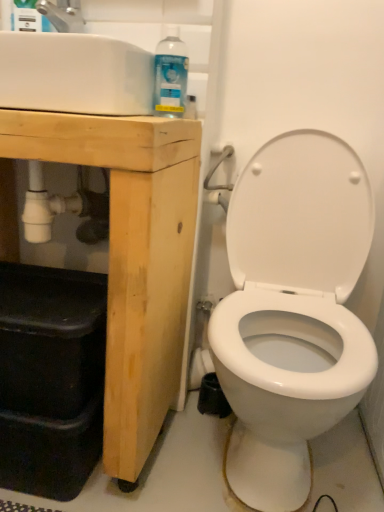
What do you see at coordinates (28, 17) in the screenshot?
I see `clear plastic spray bottle at upper left, which is counted as the second cleaning product, starting from the bottom` at bounding box center [28, 17].

The height and width of the screenshot is (512, 384). I want to click on clear plastic spray bottle at upper left, which ranks as the first cleaning product in top-to-bottom order, so click(x=28, y=17).

Describe the element at coordinates (74, 74) in the screenshot. I see `white glossy sink at upper left` at that location.

Image resolution: width=384 pixels, height=512 pixels. What do you see at coordinates (171, 74) in the screenshot?
I see `clear plastic spray bottle at upper left, the second cleaning product positioned from the top` at bounding box center [171, 74].

At what (x,y) coordinates should I click in order to perform the action: click on natural wood cabinet at left. Please return your answer as a coordinate pair (x, y). The width and height of the screenshot is (384, 512). Looking at the image, I should click on (132, 256).

Where is `brushed metal faucet at upper left`? This screenshot has height=512, width=384. brushed metal faucet at upper left is located at coordinates point(63,15).

The width and height of the screenshot is (384, 512). Find the location of `clear plastic spray bottle at upper left, which appears as the 2th cleaning product when viewed from the right`. clear plastic spray bottle at upper left, which appears as the 2th cleaning product when viewed from the right is located at coordinates (28, 17).

From the image's perspective, which one is positioned lower, natural wood cabinet at left or brushed metal faucet at upper left?

From the image's view, natural wood cabinet at left is below.

Is natural wood cabinet at left wider or thinner than brushed metal faucet at upper left?

natural wood cabinet at left is wider than brushed metal faucet at upper left.

From a real-world perspective, is natural wood cabinet at left physically below brushed metal faucet at upper left?

Correct, in the physical world, natural wood cabinet at left is lower than brushed metal faucet at upper left.

Which point is more forward, (130, 170) or (63, 28)?

Point (130, 170)

Can brushed metal faucet at upper left be found inside clear plastic spray bottle at upper left, the second cleaning product positioned from the top?

That's incorrect, brushed metal faucet at upper left is not inside clear plastic spray bottle at upper left, the second cleaning product positioned from the top.

Is clear plastic spray bottle at upper left, the second cleaning product positioned from the top, placed right next to brushed metal faucet at upper left?

There is a gap between clear plastic spray bottle at upper left, the second cleaning product positioned from the top, and brushed metal faucet at upper left.

From the image's perspective, which one is positioned lower, clear plastic spray bottle at upper left, the second cleaning product positioned from the top, or brushed metal faucet at upper left?

clear plastic spray bottle at upper left, the second cleaning product positioned from the top, from the image's perspective.

Which is in front, point (167, 98) or point (74, 28)?

Positioned in front is point (167, 98).

Is white glossy sink at upper left positioned behind clear plastic spray bottle at upper left, marked as the 1th cleaning product in a right-to-left arrangement?

No, white glossy sink at upper left is closer to the viewer.

Is white glossy sink at upper left not near clear plastic spray bottle at upper left, positioned as the 2th cleaning product in left-to-right order?

No, white glossy sink at upper left is not far away from clear plastic spray bottle at upper left, positioned as the 2th cleaning product in left-to-right order.

Considering the relative sizes of white glossy sink at upper left and clear plastic spray bottle at upper left, which appears as the first cleaning product when ordered from the bottom, in the image provided, is white glossy sink at upper left wider than clear plastic spray bottle at upper left, which appears as the first cleaning product when ordered from the bottom,?

Correct, the width of white glossy sink at upper left exceeds that of clear plastic spray bottle at upper left, which appears as the first cleaning product when ordered from the bottom.

How many degrees apart are the facing directions of clear plastic spray bottle at upper left, which is counted as the second cleaning product, starting from the bottom, and brushed metal faucet at upper left?

The angular difference between clear plastic spray bottle at upper left, which is counted as the second cleaning product, starting from the bottom, and brushed metal faucet at upper left is 0.000125 degrees.

Which of these two, clear plastic spray bottle at upper left, the first cleaning product positioned from the left, or brushed metal faucet at upper left, stands shorter?

Standing shorter between the two is brushed metal faucet at upper left.

Is brushed metal faucet at upper left a part of clear plastic spray bottle at upper left, which appears as the 2th cleaning product when viewed from the right?

That's incorrect, brushed metal faucet at upper left is not inside clear plastic spray bottle at upper left, which appears as the 2th cleaning product when viewed from the right.

Does clear plastic spray bottle at upper left, which is counted as the second cleaning product, starting from the bottom, turn towards brushed metal faucet at upper left?

No.

Between clear plastic spray bottle at upper left, which appears as the first cleaning product when ordered from the bottom, and white glossy sink at upper left, which one has larger size?

With larger size is white glossy sink at upper left.

Looking at this image, is clear plastic spray bottle at upper left, marked as the 1th cleaning product in a right-to-left arrangement, at the right side of white glossy sink at upper left?

Yes, clear plastic spray bottle at upper left, marked as the 1th cleaning product in a right-to-left arrangement, is to the right of white glossy sink at upper left.

Can you confirm if clear plastic spray bottle at upper left, marked as the 1th cleaning product in a right-to-left arrangement, is thinner than white glossy sink at upper left?

Yes, clear plastic spray bottle at upper left, marked as the 1th cleaning product in a right-to-left arrangement, is thinner than white glossy sink at upper left.

Is clear plastic spray bottle at upper left, marked as the 1th cleaning product in a right-to-left arrangement, looking in the opposite direction of white glossy sink at upper left?

No, clear plastic spray bottle at upper left, marked as the 1th cleaning product in a right-to-left arrangement, is not facing away from white glossy sink at upper left.

Can you tell me how much brushed metal faucet at upper left and clear plastic spray bottle at upper left, which ranks as the first cleaning product in top-to-bottom order, differ in facing direction?

They differ by 0.000125 degrees in their facing directions.

Can you confirm if brushed metal faucet at upper left is positioned to the left of clear plastic spray bottle at upper left, which appears as the 2th cleaning product when viewed from the right?

In fact, brushed metal faucet at upper left is to the right of clear plastic spray bottle at upper left, which appears as the 2th cleaning product when viewed from the right.

From the image's perspective, is brushed metal faucet at upper left below clear plastic spray bottle at upper left, the first cleaning product positioned from the left?

Indeed, from the image's perspective, brushed metal faucet at upper left is shown beneath clear plastic spray bottle at upper left, the first cleaning product positioned from the left.

Where is `cleaning product above the brushed metal faucet at upper left (from the image's perspective)`? cleaning product above the brushed metal faucet at upper left (from the image's perspective) is located at coordinates (28, 17).

Can we say clear plastic spray bottle at upper left, which appears as the 2th cleaning product when viewed from the right, lies outside white glossy sink at upper left?

That's correct, clear plastic spray bottle at upper left, which appears as the 2th cleaning product when viewed from the right, is outside of white glossy sink at upper left.

From a real-world perspective, is clear plastic spray bottle at upper left, which ranks as the first cleaning product in top-to-bottom order, on top of white glossy sink at upper left?

Yes, from a real-world perspective, clear plastic spray bottle at upper left, which ranks as the first cleaning product in top-to-bottom order, is on top of white glossy sink at upper left.

Which is more to the right, clear plastic spray bottle at upper left, which appears as the 2th cleaning product when viewed from the right, or white glossy sink at upper left?

white glossy sink at upper left.

Does clear plastic spray bottle at upper left, the first cleaning product positioned from the left, have a smaller size compared to white glossy sink at upper left?

Yes.

Locate an element on the screen. The image size is (384, 512). tap that appears above the natural wood cabinet at left (from the image's perspective) is located at coordinates (63, 15).

At what (x,y) coordinates should I click in order to perform the action: click on cleaning product in front of the brushed metal faucet at upper left. Please return your answer as a coordinate pair (x, y). Looking at the image, I should click on (171, 74).

From the image, which object appears to be farther from clear plastic spray bottle at upper left, which is counted as the second cleaning product, starting from the bottom, brushed metal faucet at upper left or natural wood cabinet at left?

natural wood cabinet at left is further to clear plastic spray bottle at upper left, which is counted as the second cleaning product, starting from the bottom.

Considering their positions, is clear plastic spray bottle at upper left, positioned as the 2th cleaning product in left-to-right order, positioned closer to brushed metal faucet at upper left than white glossy sink at upper left?

clear plastic spray bottle at upper left, positioned as the 2th cleaning product in left-to-right order.

From the image, which object appears to be farther from clear plastic spray bottle at upper left, the second cleaning product positioned from the top, natural wood cabinet at left or brushed metal faucet at upper left?

natural wood cabinet at left lies further to clear plastic spray bottle at upper left, the second cleaning product positioned from the top, than the other object.

From the image, which object appears to be nearer to clear plastic spray bottle at upper left, which is counted as the second cleaning product, starting from the bottom, clear plastic spray bottle at upper left, marked as the 1th cleaning product in a right-to-left arrangement, or natural wood cabinet at left?

clear plastic spray bottle at upper left, marked as the 1th cleaning product in a right-to-left arrangement, is closer to clear plastic spray bottle at upper left, which is counted as the second cleaning product, starting from the bottom.

In the scene shown: Based on their spatial positions, is clear plastic spray bottle at upper left, the first cleaning product positioned from the left, or clear plastic spray bottle at upper left, the second cleaning product positioned from the top, closer to natural wood cabinet at left?

clear plastic spray bottle at upper left, the second cleaning product positioned from the top.

Which object lies further to the anchor point clear plastic spray bottle at upper left, marked as the 1th cleaning product in a right-to-left arrangement, white glossy sink at upper left or brushed metal faucet at upper left?

Among the two, brushed metal faucet at upper left is located further to clear plastic spray bottle at upper left, marked as the 1th cleaning product in a right-to-left arrangement.

Considering their positions, is clear plastic spray bottle at upper left, the first cleaning product positioned from the left, positioned further to white glossy sink at upper left than brushed metal faucet at upper left?

clear plastic spray bottle at upper left, the first cleaning product positioned from the left, is further to white glossy sink at upper left.

Looking at the image, which one is located closer to natural wood cabinet at left, clear plastic spray bottle at upper left, the first cleaning product positioned from the left, or brushed metal faucet at upper left?

brushed metal faucet at upper left is positioned closer to the anchor natural wood cabinet at left.

What are the coordinates of `sink between brushed metal faucet at upper left and natural wood cabinet at left in the vertical direction` in the screenshot? It's located at (74, 74).

This screenshot has width=384, height=512. In order to click on sink between clear plastic spray bottle at upper left, which ranks as the first cleaning product in top-to-bottom order, and natural wood cabinet at left, in the vertical direction in this screenshot , I will do `click(74, 74)`.

Locate an element on the screen. tap between clear plastic spray bottle at upper left, the first cleaning product positioned from the left, and natural wood cabinet at left in the up-down direction is located at coordinates (63, 15).

The image size is (384, 512). I want to click on cleaning product that lies between white glossy sink at upper left and natural wood cabinet at left from top to bottom, so click(x=171, y=74).